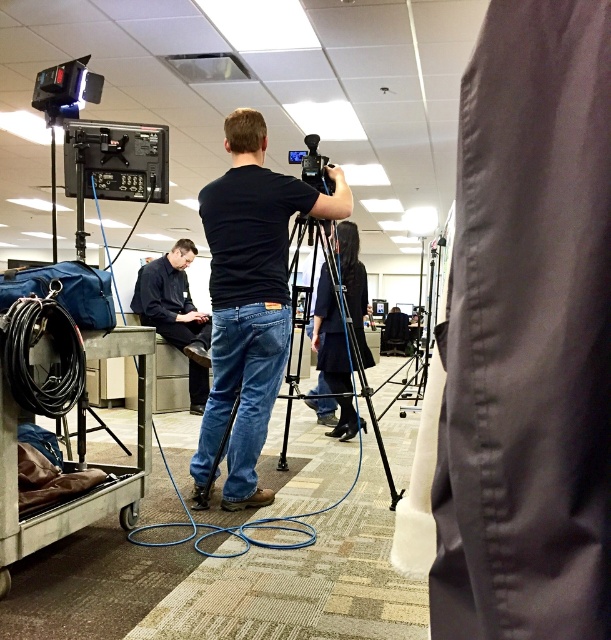
Based on the photo, can you confirm if black shirt at left is taller than dark blue jeans at center?

No, black shirt at left is not taller than dark blue jeans at center.

Does black shirt at left have a lesser height compared to dark blue jeans at center?

Indeed, black shirt at left has a lesser height compared to dark blue jeans at center.

Who is more forward, [161,292] or [342,348]?

Point [342,348]

Identify the location of black shirt at left. (175, 314).

Is point (345, 326) closer to camera compared to point (172, 291)?

Yes, point (345, 326) is closer to viewer.

Between black metal tripod at center and black shirt at left, which one has more height?

black metal tripod at center

What do you see at coordinates (345, 337) in the screenshot?
I see `black metal tripod at center` at bounding box center [345, 337].

This screenshot has height=640, width=611. Identify the location of black metal tripod at center. (345, 337).

Is black metal tripod at center taller than black matte video camera at center?

Indeed, black metal tripod at center has a greater height compared to black matte video camera at center.

Between black metal tripod at center and black matte video camera at center, which one appears on the right side from the viewer's perspective?

black metal tripod at center is more to the right.

Who is more distant from viewer, (345, 429) or (324, 172)?

Positioned behind is point (345, 429).

Locate an element on the screen. black metal tripod at center is located at coordinates (345, 337).